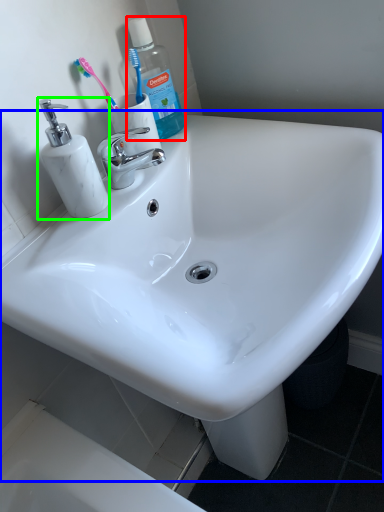
Question: Which object is the closest to the cleaning product (highlighted by a red box)? Choose among these: sink (highlighted by a blue box) or soap dispenser (highlighted by a green box).

Choices:
 (A) sink
 (B) soap dispenser

Answer: (B)